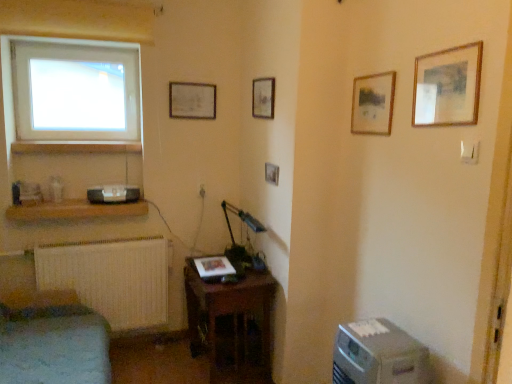
Question: Is matte wooden picture frame at upper center, which ranks as the 5th picture frame in right-to-left order, located outside wooden picture frame at center, the third picture frame when ordered from back to front?

Choices:
 (A) no
 (B) yes

Answer: (B)

Question: From a real-world perspective, is matte wooden picture frame at upper center, which ranks as the 5th picture frame in right-to-left order, physically below wooden picture frame at center, the 3th picture frame viewed from the left?

Choices:
 (A) yes
 (B) no

Answer: (B)

Question: Is matte wooden picture frame at upper center, which ranks as the fifth picture frame in front-to-back order, not near wooden picture frame at center, which is the third picture frame from front to back?

Choices:
 (A) no
 (B) yes

Answer: (A)

Question: Can you confirm if matte wooden picture frame at upper center, the first picture frame viewed from the back, is wider than wooden picture frame at center, the 3th picture frame viewed from the left?

Choices:
 (A) yes
 (B) no

Answer: (B)

Question: Does matte wooden picture frame at upper center, the first picture frame viewed from the back, have a larger size compared to wooden picture frame at center, the third picture frame when ordered from back to front?

Choices:
 (A) yes
 (B) no

Answer: (A)

Question: Can you confirm if matte wooden picture frame at upper center, which ranks as the fifth picture frame in front-to-back order, is shorter than wooden picture frame at center, which is the third picture frame from front to back?

Choices:
 (A) yes
 (B) no

Answer: (B)

Question: Does matte black speaker at lower left turn towards wooden shelf at lower left, the 2th shelf in the top-to-bottom sequence?

Choices:
 (A) yes
 (B) no

Answer: (B)

Question: Is matte black speaker at lower left smaller than wooden shelf at lower left, positioned as the first shelf in bottom-to-top order?

Choices:
 (A) no
 (B) yes

Answer: (B)

Question: Is matte black speaker at lower left at the right side of wooden shelf at lower left, the 2th shelf in the top-to-bottom sequence?

Choices:
 (A) yes
 (B) no

Answer: (A)

Question: From a real-world perspective, is matte black speaker at lower left on wooden shelf at lower left, the 2th shelf in the top-to-bottom sequence?

Choices:
 (A) no
 (B) yes

Answer: (B)

Question: Is matte black speaker at lower left far from wooden shelf at lower left, positioned as the first shelf in bottom-to-top order?

Choices:
 (A) no
 (B) yes

Answer: (A)

Question: Could wooden shelf at lower left, positioned as the first shelf in bottom-to-top order, be considered to be inside matte black speaker at lower left?

Choices:
 (A) no
 (B) yes

Answer: (A)

Question: From a real-world perspective, is matte wooden picture frame at upper center, the first picture frame viewed from the back, located beneath white matte radiator at lower left?

Choices:
 (A) no
 (B) yes

Answer: (A)